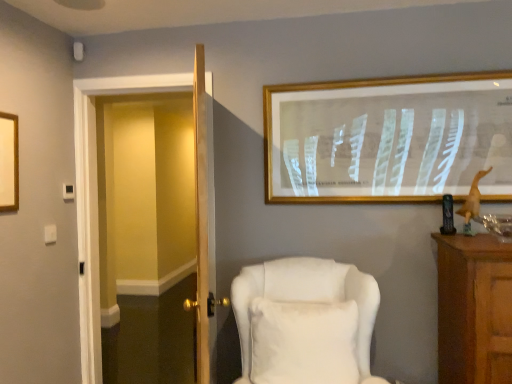
Question: Is white fluffy pillow at center inside the boundaries of white fabric chair at center, or outside?

Choices:
 (A) inside
 (B) outside

Answer: (A)

Question: Is white fluffy pillow at center wider or thinner than white fabric chair at center?

Choices:
 (A) wide
 (B) thin

Answer: (B)

Question: Based on their relative distances, which object is nearer to the white fabric chair at center?

Choices:
 (A) white fluffy pillow at center
 (B) transparent glass door at left
 (C) gold-framed artwork at upper center

Answer: (A)

Question: Which is farther from the white fluffy pillow at center?

Choices:
 (A) transparent glass door at left
 (B) white fabric chair at center
 (C) gold-framed artwork at upper center

Answer: (A)